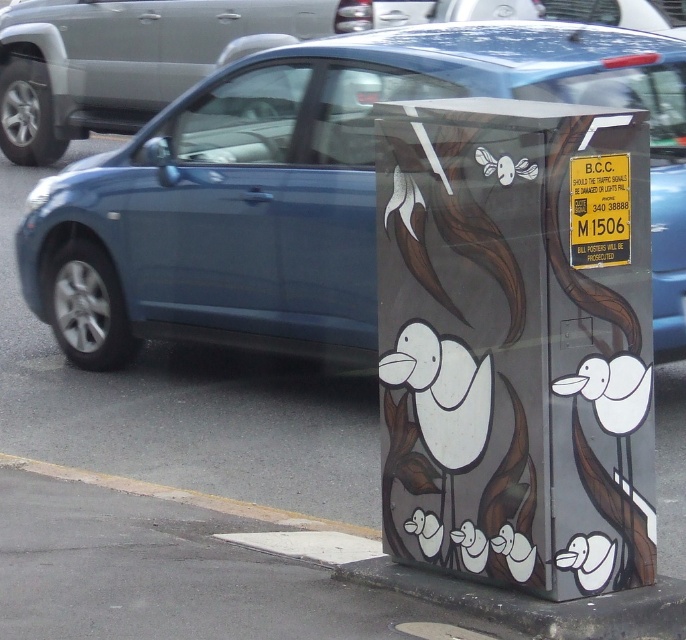
Is point (93, 273) positioned behind point (257, 588)?

Yes, it is behind point (257, 588).

Is metallic blue car at center closer to camera compared to smooth concrete curb at lower left?

No, it is behind smooth concrete curb at lower left.

Does point (329, 54) come closer to viewer compared to point (191, 513)?

No, (329, 54) is further to viewer.

Locate an element on the screen. This screenshot has height=640, width=686. metallic blue car at center is located at coordinates (314, 188).

Describe the element at coordinates (217, 570) in the screenshot. I see `smooth concrete curb at lower left` at that location.

Does smooth concrete curb at lower left appear under metallic blue sedan at center?

Yes.

The image size is (686, 640). Find the location of `smooth concrete curb at lower left`. smooth concrete curb at lower left is located at coordinates (217, 570).

Who is higher up, metallic blue car at center or metallic blue sedan at center?

Positioned higher is metallic blue sedan at center.

Who is shorter, metallic blue car at center or metallic blue sedan at center?

With less height is metallic blue sedan at center.

Between point (235, 252) and point (530, 12), which one is positioned behind?

Positioned behind is point (530, 12).

The height and width of the screenshot is (640, 686). I want to click on metallic blue car at center, so click(314, 188).